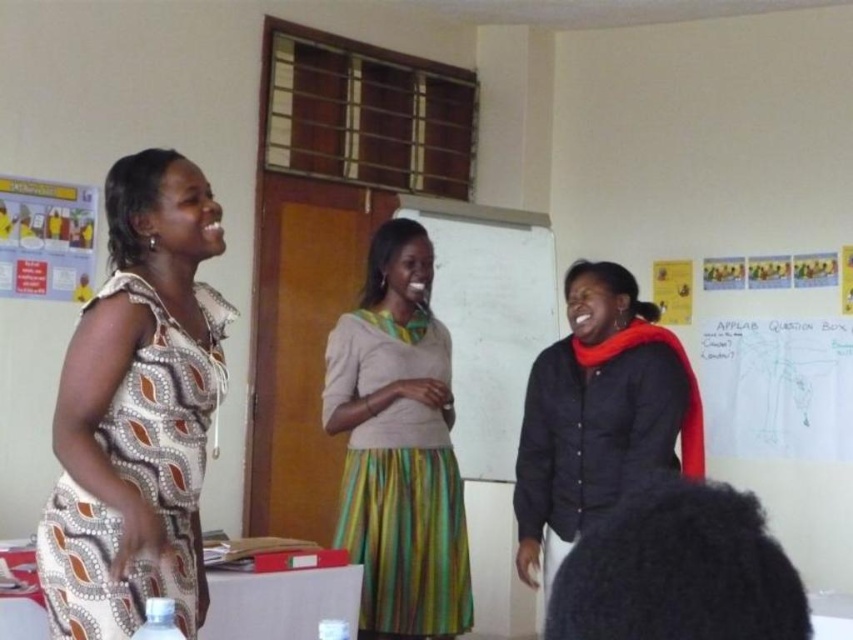
Question: Among these points, which one is farthest from the camera?

Choices:
 (A) (590, 285)
 (B) (189, 163)
 (C) (450, 486)
 (D) (526, 356)

Answer: (D)

Question: Can you confirm if printed fabric dress at left is bigger than black matte jacket at center?

Choices:
 (A) no
 (B) yes

Answer: (A)

Question: Which object is farther from the camera taking this photo?

Choices:
 (A) whiteboard at center
 (B) black matte jacket at center
 (C) printed fabric dress at left
 (D) green striped skirt at center

Answer: (A)

Question: Can you confirm if black matte jacket at center is positioned to the left of whiteboard at center?

Choices:
 (A) yes
 (B) no

Answer: (B)

Question: Does green striped skirt at center come behind whiteboard at center?

Choices:
 (A) yes
 (B) no

Answer: (B)

Question: Which object is farther from the camera taking this photo?

Choices:
 (A) green striped skirt at center
 (B) printed fabric dress at left
 (C) black matte jacket at center
 (D) whiteboard at center

Answer: (D)